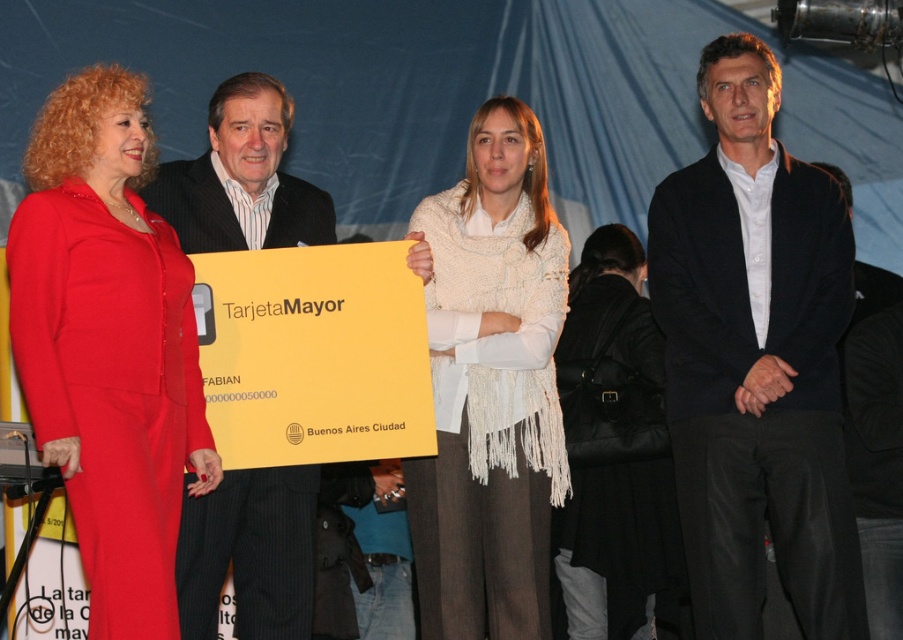
Question: Considering the real-world distances, which object is closest to the white knitted scarf at center?

Choices:
 (A) matte red dress at left
 (B) black leather handbag at center

Answer: (B)

Question: Which of these objects is positioned farthest from the matte red dress at left?

Choices:
 (A) dark blue textured blazer at right
 (B) white knitted scarf at center
 (C) black leather handbag at center
 (D) dark suit at center

Answer: (A)

Question: Is dark blue textured blazer at right wider than matte red dress at left?

Choices:
 (A) yes
 (B) no

Answer: (A)

Question: Observing the image, what is the correct spatial positioning of white knitted scarf at center in reference to dark suit at center?

Choices:
 (A) above
 (B) below

Answer: (B)

Question: Does matte red dress at left appear on the right side of white knitted scarf at center?

Choices:
 (A) yes
 (B) no

Answer: (B)

Question: Which point appears closest to the camera in this image?

Choices:
 (A) (90, 220)
 (B) (636, 518)
 (C) (284, 189)

Answer: (A)